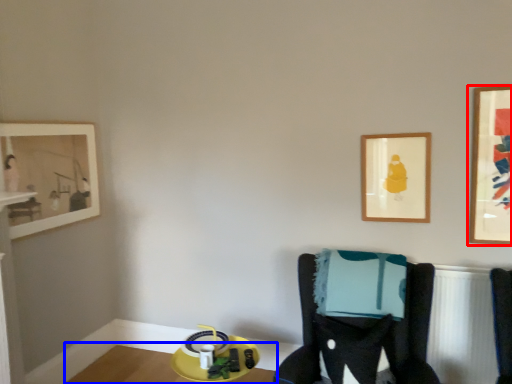
Question: Which object appears farthest to the camera in this image, picture frame (highlighted by a red box) or table (highlighted by a blue box)?

Choices:
 (A) picture frame
 (B) table

Answer: (B)